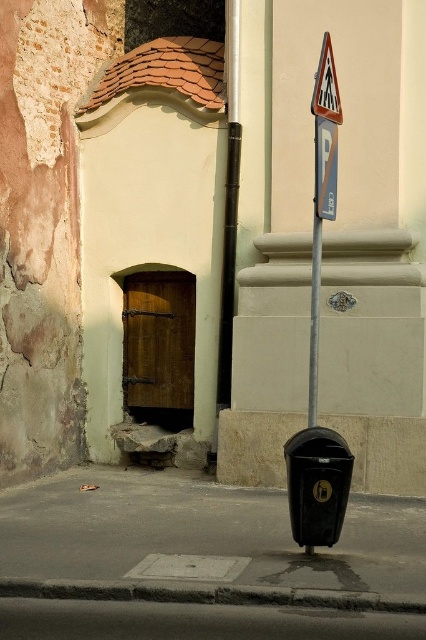
You are a GUI agent. You are given a task and a screenshot of the screen. Output one action in this format:
    pyautogui.click(x=<x>, y=<y>)
    Task: Click on the black asphalt pavement at lower center
    
    Given the screenshot: What is the action you would take?
    pyautogui.click(x=199, y=563)

Who is taller, black asphalt pavement at lower center or gray concrete curb at lower center?

black asphalt pavement at lower center is taller.

Who is shorter, black asphalt pavement at lower center or gray concrete curb at lower center?

With less height is gray concrete curb at lower center.

Where is `black asphalt pavement at lower center`? Image resolution: width=426 pixels, height=640 pixels. black asphalt pavement at lower center is located at coordinates (199, 563).

Can you confirm if gray concrete curb at lower center is thinner than white plastic triangle at upper center?

No.

Between point (172, 595) and point (331, 113), which one is positioned in front?

Positioned in front is point (172, 595).

Does point (201, 596) lie in front of point (316, 88)?

Yes, point (201, 596) is closer to viewer.

At what (x,y) coordinates should I click in order to perform the action: click on gray concrete curb at lower center. Please return your answer as a coordinate pair (x, y). Looking at the image, I should click on (210, 595).